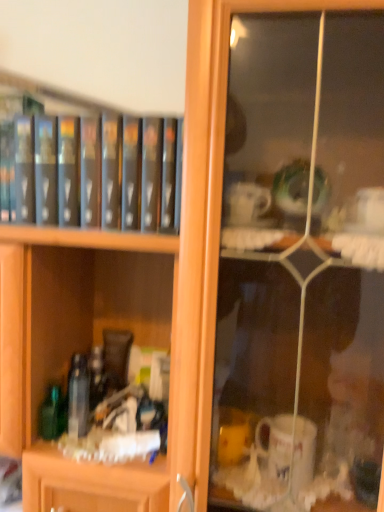
In order to click on green glass bottle at lower left, which is the 1th bottle in left-to-right order in this screenshot , I will do `click(52, 414)`.

Where is `clear glass bottle at center, arranged as the second bottle when viewed from the left`? Image resolution: width=384 pixels, height=512 pixels. clear glass bottle at center, arranged as the second bottle when viewed from the left is located at coordinates (78, 396).

Which object is further away from the camera taking this photo, clear glass bottle at center, the first bottle from the right, or green glass bottle at lower left, which is the 1th bottle in left-to-right order?

green glass bottle at lower left, which is the 1th bottle in left-to-right order, is further away from the camera.

In terms of width, does clear glass bottle at center, arranged as the second bottle when viewed from the left, look wider or thinner when compared to green glass bottle at lower left, which is the 1th bottle in left-to-right order?

Clearly, clear glass bottle at center, arranged as the second bottle when viewed from the left, has less width compared to green glass bottle at lower left, which is the 1th bottle in left-to-right order.

Does clear glass bottle at center, the first bottle from the right, contain green glass bottle at lower left, which appears as the second bottle when viewed from the right?

No.

From the image's perspective, is clear glass bottle at center, the first bottle from the right, located above or below green glass bottle at lower left, which appears as the second bottle when viewed from the right?

Based on their image positions, clear glass bottle at center, the first bottle from the right, is located above green glass bottle at lower left, which appears as the second bottle when viewed from the right.

Would you say clear glass bottle at center, arranged as the second bottle when viewed from the left, is part of green glass bottle at lower left, which is the 1th bottle in left-to-right order,'s contents?

No, clear glass bottle at center, arranged as the second bottle when viewed from the left, is located outside of green glass bottle at lower left, which is the 1th bottle in left-to-right order.

Between green glass bottle at lower left, which appears as the second bottle when viewed from the right, and clear glass bottle at center, the first bottle from the right, which one is positioned behind?

Positioned behind is green glass bottle at lower left, which appears as the second bottle when viewed from the right.

From the image's perspective, which is below, green glass bottle at lower left, which is the 1th bottle in left-to-right order, or clear glass bottle at center, arranged as the second bottle when viewed from the left?

green glass bottle at lower left, which is the 1th bottle in left-to-right order, from the image's perspective.

Is point (115, 168) farther from viewer compared to point (48, 408)?

That is False.

Is black matte book at upper left aimed at green glass bottle at lower left, which is the 1th bottle in left-to-right order?

No, black matte book at upper left is not oriented towards green glass bottle at lower left, which is the 1th bottle in left-to-right order.

From a real-world perspective, between black matte book at upper left and green glass bottle at lower left, which appears as the second bottle when viewed from the right, who is vertically lower?

green glass bottle at lower left, which appears as the second bottle when viewed from the right.

Looking at this image, considering the positions of objects black matte book at upper left and green glass bottle at lower left, which is the 1th bottle in left-to-right order, in the image provided, who is more to the right, black matte book at upper left or green glass bottle at lower left, which is the 1th bottle in left-to-right order,?

Positioned to the right is black matte book at upper left.

From the image's perspective, which one is positioned higher, black matte book at upper left or clear glass bottle at center, arranged as the second bottle when viewed from the left?

black matte book at upper left, from the image's perspective.

Can you confirm if black matte book at upper left is wider than clear glass bottle at center, the first bottle from the right?

Yes.

From the image's perspective, count 1st bottles downward from the black matte book at upper left and point to it. Please provide its 2D coordinates.

[(78, 396)]

Is black matte book at upper left looking in the opposite direction of clear glass bottle at center, arranged as the second bottle when viewed from the left?

That's not correct — black matte book at upper left is not looking away from clear glass bottle at center, arranged as the second bottle when viewed from the left.

Between point (58, 386) and point (159, 187), which one is positioned behind?

The point (58, 386) is farther from the camera.

Is green glass bottle at lower left, which is the 1th bottle in left-to-right order, wider or thinner than black matte book at upper left?

green glass bottle at lower left, which is the 1th bottle in left-to-right order, is thinner than black matte book at upper left.

In terms of size, does green glass bottle at lower left, which appears as the second bottle when viewed from the right, appear bigger or smaller than black matte book at upper left?

green glass bottle at lower left, which appears as the second bottle when viewed from the right, is smaller than black matte book at upper left.

How different are the orientations of green glass bottle at lower left, which is the 1th bottle in left-to-right order, and black matte book at upper left in degrees?

1.71 degrees separate the facing orientations of green glass bottle at lower left, which is the 1th bottle in left-to-right order, and black matte book at upper left.

From a real-world perspective, is clear glass bottle at center, the first bottle from the right, physically located above or below black matte book at upper left?

From a real-world perspective, clear glass bottle at center, the first bottle from the right, is physically below black matte book at upper left.

Is clear glass bottle at center, the first bottle from the right, positioned before black matte book at upper left?

No, it is behind black matte book at upper left.

At what (x,y) coordinates should I click in order to perform the action: click on bottle that appears on the right of black matte book at upper left. Please return your answer as a coordinate pair (x, y). This screenshot has width=384, height=512. Looking at the image, I should click on (78, 396).

Considering the positions of objects clear glass bottle at center, arranged as the second bottle when viewed from the left, and black matte book at upper left in the image provided, who is more to the right, clear glass bottle at center, arranged as the second bottle when viewed from the left, or black matte book at upper left?

From the viewer's perspective, clear glass bottle at center, arranged as the second bottle when viewed from the left, appears more on the right side.

This screenshot has width=384, height=512. In order to click on bottle below the clear glass bottle at center, the first bottle from the right (from the image's perspective) in this screenshot , I will do `click(52, 414)`.

Image resolution: width=384 pixels, height=512 pixels. Identify the location of bottle on the left side of clear glass bottle at center, the first bottle from the right. (52, 414).

From the picture: Which object lies nearer to the anchor point black matte book at upper left, green glass bottle at lower left, which is the 1th bottle in left-to-right order, or clear glass bottle at center, the first bottle from the right?

A: Based on the image, clear glass bottle at center, the first bottle from the right, appears to be nearer to black matte book at upper left.

Based on their spatial positions, is clear glass bottle at center, the first bottle from the right, or black matte book at upper left closer to green glass bottle at lower left, which appears as the second bottle when viewed from the right?

clear glass bottle at center, the first bottle from the right, is closer to green glass bottle at lower left, which appears as the second bottle when viewed from the right.

Based on their spatial positions, is black matte book at upper left or clear glass bottle at center, arranged as the second bottle when viewed from the left, closer to green glass bottle at lower left, which appears as the second bottle when viewed from the right?

clear glass bottle at center, arranged as the second bottle when viewed from the left, is positioned closer to the anchor green glass bottle at lower left, which appears as the second bottle when viewed from the right.

Which object lies nearer to the anchor point black matte book at upper left, clear glass bottle at center, the first bottle from the right, or green glass bottle at lower left, which appears as the second bottle when viewed from the right?

The object closer to black matte book at upper left is clear glass bottle at center, the first bottle from the right.

From the image, which object appears to be farther from clear glass bottle at center, the first bottle from the right, black matte book at upper left or green glass bottle at lower left, which is the 1th bottle in left-to-right order?

The object further to clear glass bottle at center, the first bottle from the right, is black matte book at upper left.

Considering their positions, is green glass bottle at lower left, which is the 1th bottle in left-to-right order, positioned further to clear glass bottle at center, the first bottle from the right, than black matte book at upper left?

black matte book at upper left is positioned further to the anchor clear glass bottle at center, the first bottle from the right.

Image resolution: width=384 pixels, height=512 pixels. What are the coordinates of `bottle between black matte book at upper left and green glass bottle at lower left, which appears as the second bottle when viewed from the right, in the vertical direction` in the screenshot? It's located at (78, 396).